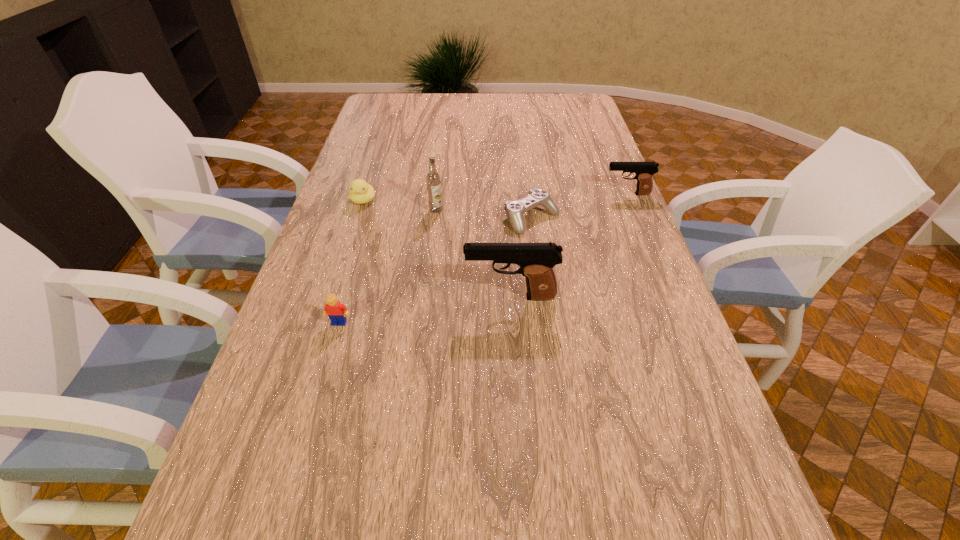
With all pistols evenly spaced, where should an extra pistol be placed on the left to continue the pattern? Please point out a vacant space. Please provide its 2D coordinates. Your answer should be formatted as a tuple, i.e. [(x, y)], where the tuple contains the x and y coordinates of a point satisfying the conditions above.

[(300, 483)]